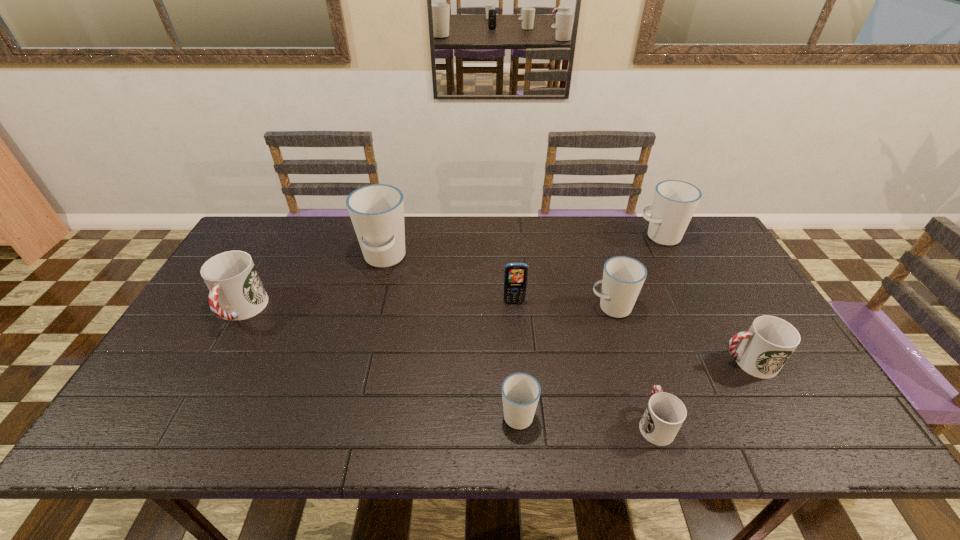
Identify the location of vacant space at the far right corner of the desktop. The height and width of the screenshot is (540, 960). (715, 251).

You are a GUI agent. You are given a task and a screenshot of the screen. Output one action in this format:
    pyautogui.click(x=<x>, y=<y>)
    Task: Click on the unoccupied position between the shortest object and the third cup from left to right
    
    Given the screenshot: What is the action you would take?
    pyautogui.click(x=587, y=418)

Find the location of `vacant area that lies between the second farthest red cup and the cellular telephone`. vacant area that lies between the second farthest red cup and the cellular telephone is located at coordinates (631, 332).

Where is `free space between the cellular telephone and the sixth cup from right to left`? This screenshot has height=540, width=960. free space between the cellular telephone and the sixth cup from right to left is located at coordinates (449, 280).

I want to click on vacant space in between the leftmost object and the third white cup from left to right, so click(426, 309).

At what (x,y) coordinates should I click in order to perform the action: click on free space between the second white cup from left to right and the rightmost white cup. Please return your answer as a coordinate pair (x, y). Looking at the image, I should click on (589, 325).

The width and height of the screenshot is (960, 540). In order to click on free point between the shortest cup and the biggest white cup in this screenshot , I will do `click(519, 341)`.

The width and height of the screenshot is (960, 540). I want to click on vacant region between the shortest cup and the tallest object, so click(x=519, y=341).

You are a GUI agent. You are given a task and a screenshot of the screen. Output one action in this format:
    pyautogui.click(x=<x>, y=<y>)
    Task: Click on the free space between the third smallest white cup and the nearest white cup
    This screenshot has height=540, width=960.
    Given the screenshot: What is the action you would take?
    pyautogui.click(x=589, y=325)

Locate an element on the screen. This screenshot has width=960, height=540. vacant space that is in between the second white cup from right to left and the second red cup from right to left is located at coordinates (633, 365).